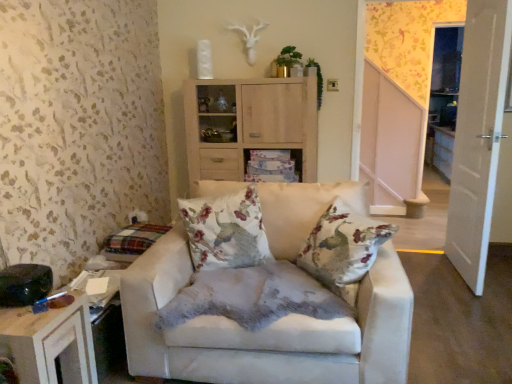
Question: Can you confirm if floral fabric cushion at center is smaller than white glossy door at right?

Choices:
 (A) no
 (B) yes

Answer: (B)

Question: From the image's perspective, would you say floral fabric cushion at center is shown under white glossy door at right?

Choices:
 (A) no
 (B) yes

Answer: (B)

Question: From the image's perspective, is floral fabric cushion at center over white glossy door at right?

Choices:
 (A) yes
 (B) no

Answer: (B)

Question: Is floral fabric cushion at center facing away from white glossy door at right?

Choices:
 (A) no
 (B) yes

Answer: (A)

Question: Would you say floral fabric cushion at center is outside white glossy door at right?

Choices:
 (A) no
 (B) yes

Answer: (B)

Question: Is floral fabric cushion at center beside white glossy door at right?

Choices:
 (A) yes
 (B) no

Answer: (B)

Question: From a real-world perspective, does white glossy door at right stand above wooden table at lower left?

Choices:
 (A) yes
 (B) no

Answer: (A)

Question: Is white glossy door at right not near wooden table at lower left?

Choices:
 (A) yes
 (B) no

Answer: (A)

Question: Is white glossy door at right positioned behind wooden table at lower left?

Choices:
 (A) no
 (B) yes

Answer: (B)

Question: Can you confirm if white glossy door at right is shorter than wooden table at lower left?

Choices:
 (A) yes
 (B) no

Answer: (B)

Question: From a real-world perspective, is white glossy door at right located beneath wooden table at lower left?

Choices:
 (A) no
 (B) yes

Answer: (A)

Question: From the image's perspective, is white glossy door at right under wooden table at lower left?

Choices:
 (A) yes
 (B) no

Answer: (B)

Question: Can you confirm if white glossy cabinet at center is thinner than floral fabric cushion at center?

Choices:
 (A) no
 (B) yes

Answer: (A)